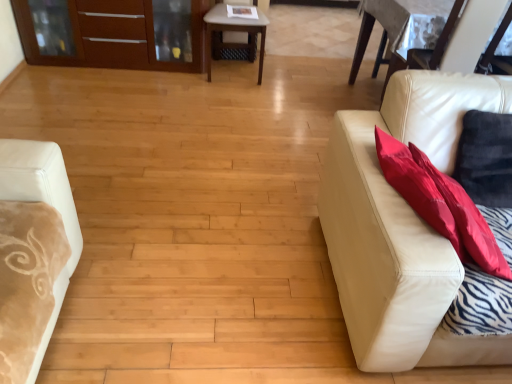
Question: From a real-world perspective, does light brown wooden table at center sit lower than leather couch at right?

Choices:
 (A) no
 (B) yes

Answer: (B)

Question: Is light brown wooden table at center not close to leather couch at right?

Choices:
 (A) yes
 (B) no

Answer: (A)

Question: Can you confirm if light brown wooden table at center is taller than leather couch at right?

Choices:
 (A) no
 (B) yes

Answer: (A)

Question: From the image's perspective, is light brown wooden table at center on top of leather couch at right?

Choices:
 (A) yes
 (B) no

Answer: (A)

Question: Is light brown wooden table at center not within leather couch at right?

Choices:
 (A) no
 (B) yes

Answer: (B)

Question: Is light brown wooden table at center facing away from leather couch at right?

Choices:
 (A) yes
 (B) no

Answer: (B)

Question: Considering the relative sizes of red fabric pillow at right and leather couch at right in the image provided, is red fabric pillow at right shorter than leather couch at right?

Choices:
 (A) yes
 (B) no

Answer: (A)

Question: Is red fabric pillow at right facing away from leather couch at right?

Choices:
 (A) no
 (B) yes

Answer: (B)

Question: From a real-world perspective, is red fabric pillow at right beneath leather couch at right?

Choices:
 (A) no
 (B) yes

Answer: (A)

Question: Is red fabric pillow at right smaller than leather couch at right?

Choices:
 (A) yes
 (B) no

Answer: (A)

Question: Can you confirm if red fabric pillow at right is bigger than leather couch at right?

Choices:
 (A) yes
 (B) no

Answer: (B)

Question: Does red fabric pillow at right contain leather couch at right?

Choices:
 (A) no
 (B) yes

Answer: (A)

Question: Considering the relative sizes of leather couch at right and matte wood dresser at upper left in the image provided, is leather couch at right thinner than matte wood dresser at upper left?

Choices:
 (A) no
 (B) yes

Answer: (A)